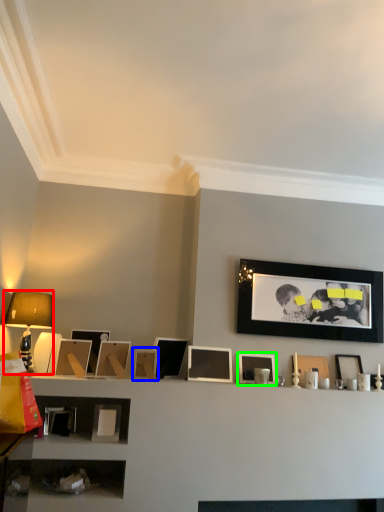
Question: Which object is positioned farthest from table lamp (highlighted by a red box)? Select from picture frame (highlighted by a blue box) and picture frame (highlighted by a green box).

Choices:
 (A) picture frame
 (B) picture frame

Answer: (B)